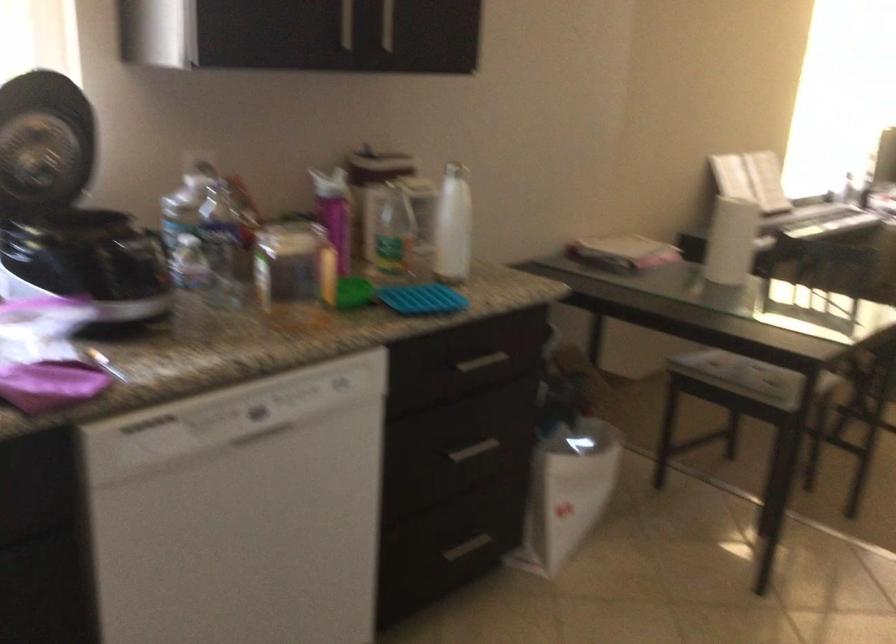
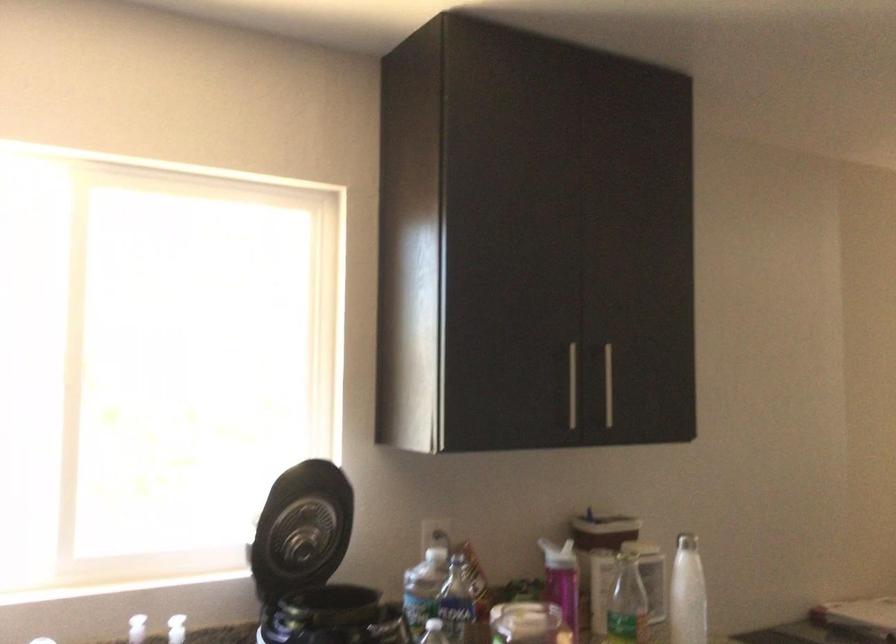
Find the pixel in the second image that matches (x=449, y=220) in the first image.

(687, 592)